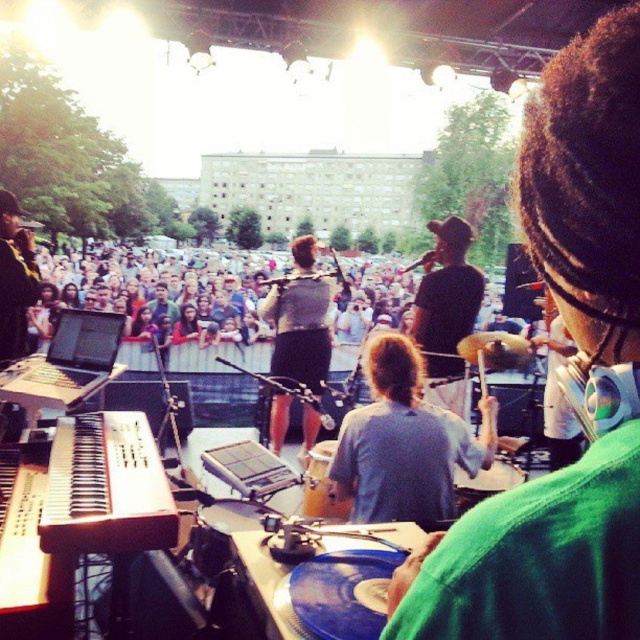
You are a photographer positioned at the back of the concert venue. You want to capture a photo of the DJ and the piano. Based on the scene, which object is closer to the camera between the gray fabric shirt at center and the wooden piano at center?

The gray fabric shirt at center is located below the wooden piano at center, meaning the gray fabric shirt is closer to the camera than the wooden piano at center.

You are a photographer at the concert wanting to capture the DJ and the piano in the same frame. Since the wooden piano at center is behind the gray fabric shirt at center, will the DJ be blocking the view of the piano?

The wooden piano at center is behind the gray fabric shirt at center, so the DJ wearing the gray fabric shirt at center will block the view of the piano.